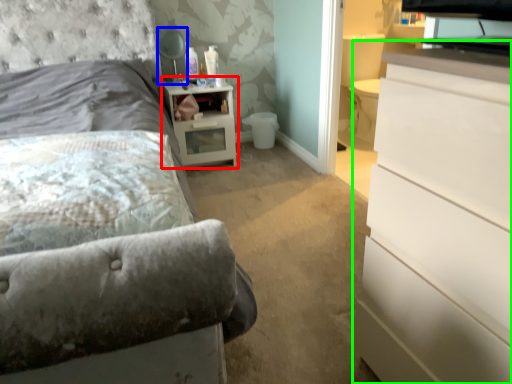
Question: Which object is positioned farthest from nightstand (highlighted by a red box)? Select from table lamp (highlighted by a blue box) and chest of drawers (highlighted by a green box).

Choices:
 (A) table lamp
 (B) chest of drawers

Answer: (B)